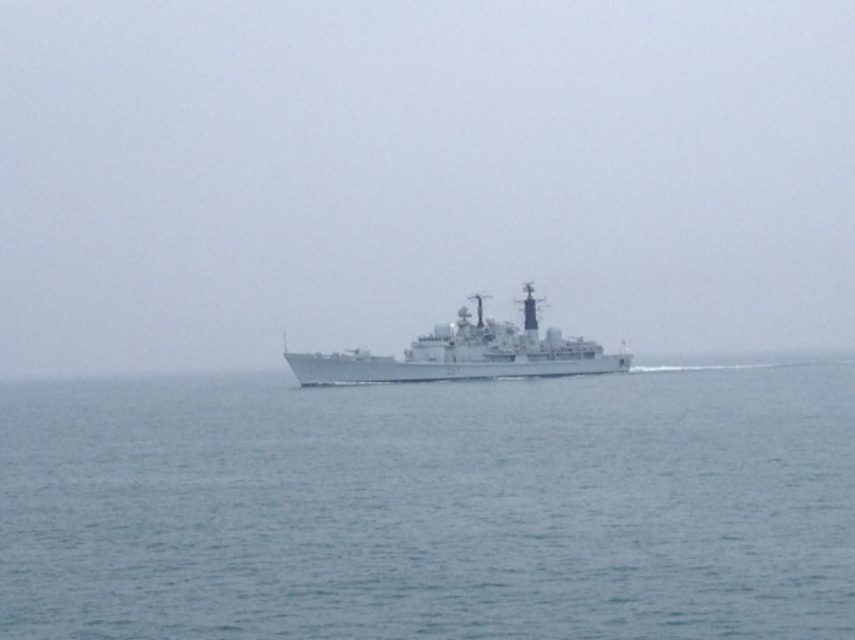
Question: In this image, where is blue water at center located relative to gray metallic ship at center?

Choices:
 (A) below
 (B) above

Answer: (A)

Question: Is blue water at center positioned in front of gray metallic ship at center?

Choices:
 (A) no
 (B) yes

Answer: (B)

Question: Which of the following is the farthest from the observer?

Choices:
 (A) gray metallic ship at center
 (B) blue water at center

Answer: (A)

Question: Is blue water at center below gray metallic ship at center?

Choices:
 (A) no
 (B) yes

Answer: (B)